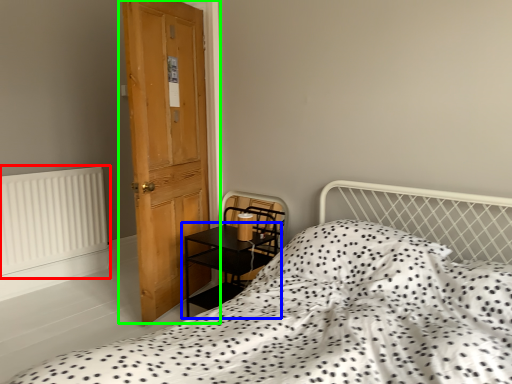
Question: Which is nearer to the radiator (highlighted by a red box)? table (highlighted by a blue box) or door (highlighted by a green box).

Choices:
 (A) table
 (B) door

Answer: (B)